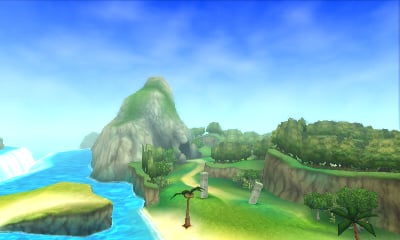
The width and height of the screenshot is (400, 240). I want to click on pillar, so click(x=258, y=190), click(x=203, y=192).